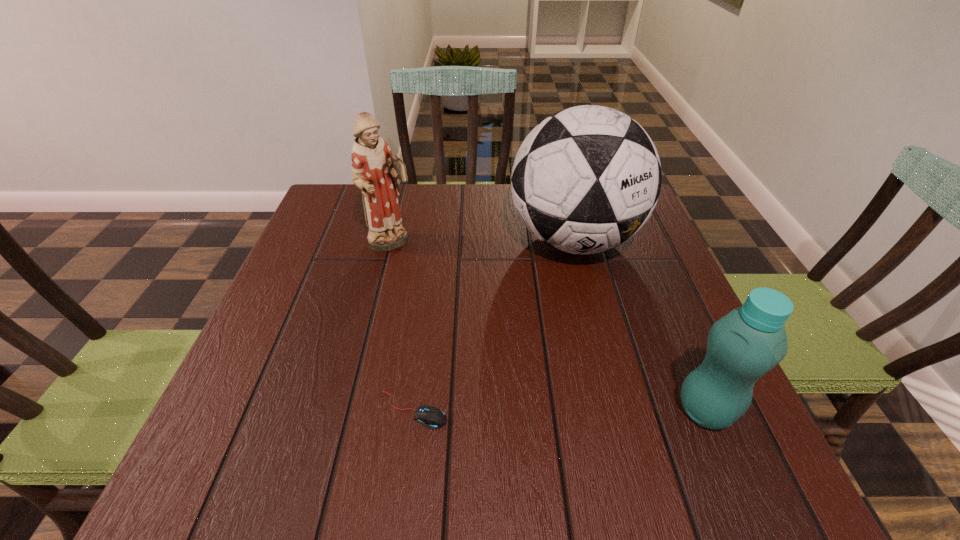
Locate an element on the screen. This screenshot has height=540, width=960. vacant space that's between the soccer ball and the mouse is located at coordinates (493, 325).

Where is `empty space that is in between the mouse and the figurine`? The image size is (960, 540). empty space that is in between the mouse and the figurine is located at coordinates (402, 327).

Find the location of a particular element. The image size is (960, 540). free space between the soccer ball and the water bottle is located at coordinates (639, 325).

At what (x,y) coordinates should I click in order to perform the action: click on free spot between the figurine and the soccer ball. Please return your answer as a coordinate pair (x, y). This screenshot has width=960, height=540. Looking at the image, I should click on (483, 242).

Find the location of a particular element. The height and width of the screenshot is (540, 960). free point between the figurine and the soccer ball is located at coordinates (483, 242).

Find the location of a particular element. This screenshot has width=960, height=540. vacant space in between the soccer ball and the third tallest object is located at coordinates (639, 325).

I want to click on object that stands as the third closest to the figurine, so click(748, 342).

Locate an element on the screen. The image size is (960, 540). object that is the second closest to the water bottle is located at coordinates (431, 417).

You are a GUI agent. You are given a task and a screenshot of the screen. Output one action in this format:
    pyautogui.click(x=<x>, y=<y>)
    Task: Click on the free spot that satisfies the following two spatial constraints: 1. on the front side of the third tallest object; 2. at the front cap of the figurine
    Image resolution: width=960 pixels, height=540 pixels.
    Given the screenshot: What is the action you would take?
    pyautogui.click(x=352, y=410)

You are a GUI agent. You are given a task and a screenshot of the screen. Output one action in this format:
    pyautogui.click(x=<x>, y=<y>)
    Task: Click on the blank area in the image that satisfies the following two spatial constraints: 1. on the back side of the soccer ball; 2. on the right side of the mouse
    The height and width of the screenshot is (540, 960).
    Given the screenshot: What is the action you would take?
    pyautogui.click(x=435, y=240)